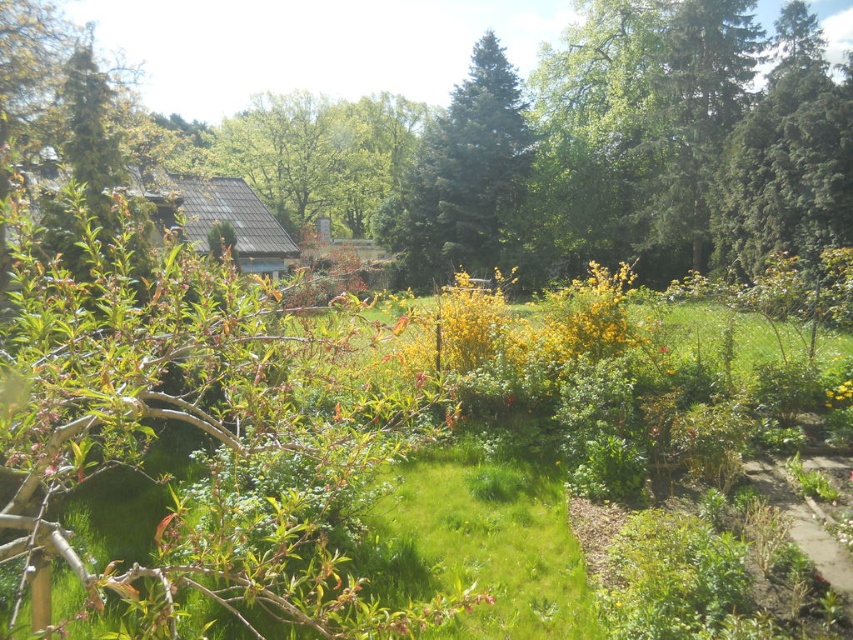
You are a gardener who wants to plant a new flower in the garden. You have a yellow matte flower at lower right and a green textured tree at upper right. Which one is closer to you from your current position in the garden?

The yellow matte flower at lower right is behind the green textured tree at upper right, so the green textured tree at upper right is closer to you.

You are standing at the entrance of the garden and see the green textured tree at upper right and the yellow matte flower at lower right. Which object is positioned to the right side of the other?

The green textured tree at upper right is to the right of the yellow matte flower at lower right.